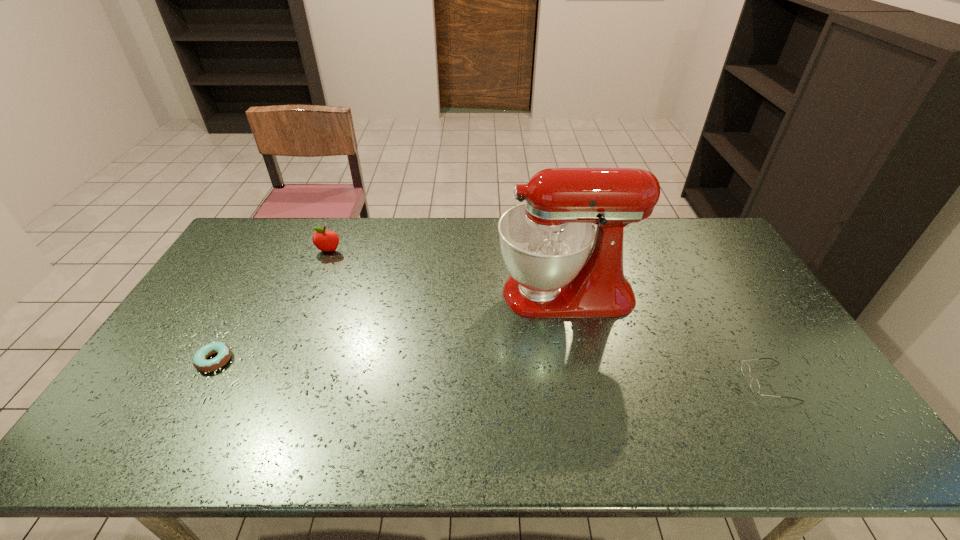
This screenshot has height=540, width=960. I want to click on free region located at the attachment hub of the mixer, so click(386, 293).

At what (x,y) coordinates should I click in order to perform the action: click on vacant space located on the left of the farthest object. Please return your answer as a coordinate pair (x, y). Looking at the image, I should click on (231, 251).

Identify the location of vacant space located through the lenses of the rightmost object. This screenshot has width=960, height=540. (727, 382).

You are a GUI agent. You are given a task and a screenshot of the screen. Output one action in this format:
    pyautogui.click(x=<x>, y=<y>)
    Task: Click on the free space located 0.220m through the lenses of the rightmost object
    The image size is (960, 540).
    Given the screenshot: What is the action you would take?
    pyautogui.click(x=661, y=382)

The width and height of the screenshot is (960, 540). In order to click on blank area located through the lenses of the rightmost object in this screenshot , I will do `click(646, 382)`.

Locate an element on the screen. vacant region located 0.070m on the right of the leftmost object is located at coordinates (257, 360).

You are a GUI agent. You are given a task and a screenshot of the screen. Output one action in this format:
    pyautogui.click(x=<x>, y=<y>)
    Task: Click on the object positioned at the far edge
    The width and height of the screenshot is (960, 540).
    Given the screenshot: What is the action you would take?
    pyautogui.click(x=326, y=241)

At what (x,y) coordinates should I click in order to perform the action: click on object located at the left edge. Please return your answer as a coordinate pair (x, y). Looking at the image, I should click on (223, 350).

At what (x,y) coordinates should I click in order to perform the action: click on object present at the right edge. Please return your answer as a coordinate pair (x, y). The height and width of the screenshot is (540, 960). Looking at the image, I should click on (754, 384).

Locate an element on the screen. Image resolution: width=960 pixels, height=540 pixels. vacant area at the far edge is located at coordinates (358, 232).